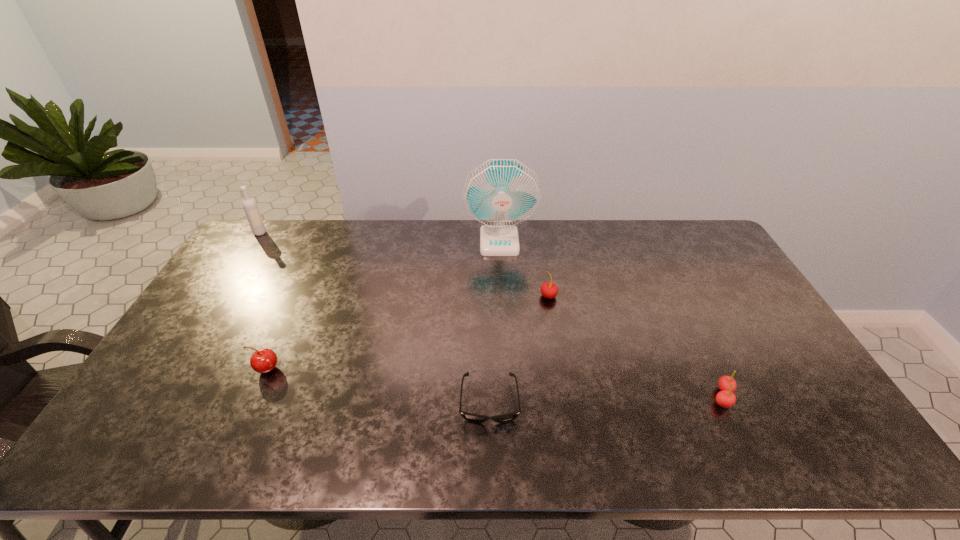
Image resolution: width=960 pixels, height=540 pixels. Find the location of `free spot between the third farthest object and the sunglasses`. free spot between the third farthest object and the sunglasses is located at coordinates (519, 349).

Find the location of `free spot between the leftmost cherry and the rightmost cherry`. free spot between the leftmost cherry and the rightmost cherry is located at coordinates (494, 383).

Image resolution: width=960 pixels, height=540 pixels. I want to click on free space between the farthest cherry and the rightmost cherry, so click(636, 346).

You are a GUI agent. You are given a task and a screenshot of the screen. Output one action in this format:
    pyautogui.click(x=<x>, y=<y>)
    Task: Click on the free space between the vodka and the fan
    This screenshot has width=960, height=540.
    Given the screenshot: What is the action you would take?
    pyautogui.click(x=380, y=237)

The height and width of the screenshot is (540, 960). I want to click on vacant area that lies between the fan and the leftmost object, so click(380, 237).

Where is `empty space between the rightmost object and the shortest object`? The height and width of the screenshot is (540, 960). empty space between the rightmost object and the shortest object is located at coordinates (606, 399).

Identify the location of free space that is in between the tallest object and the leftmost object. (380, 237).

Point out which object is positioned as the nearest to the fifth shortest object. Please provide its 2D coordinates. Your answer should be formatted as a tuple, i.e. [(x, y)], where the tuple contains the x and y coordinates of a point satisfying the conditions above.

[(264, 360)]

Select which object appears as the third closest to the shortest object. Please provide its 2D coordinates. Your answer should be formatted as a tuple, i.e. [(x, y)], where the tuple contains the x and y coordinates of a point satisfying the conditions above.

[(264, 360)]

Select which cherry is the closest to the rightmost cherry. Please provide its 2D coordinates. Your answer should be formatted as a tuple, i.e. [(x, y)], where the tuple contains the x and y coordinates of a point satisfying the conditions above.

[(549, 290)]